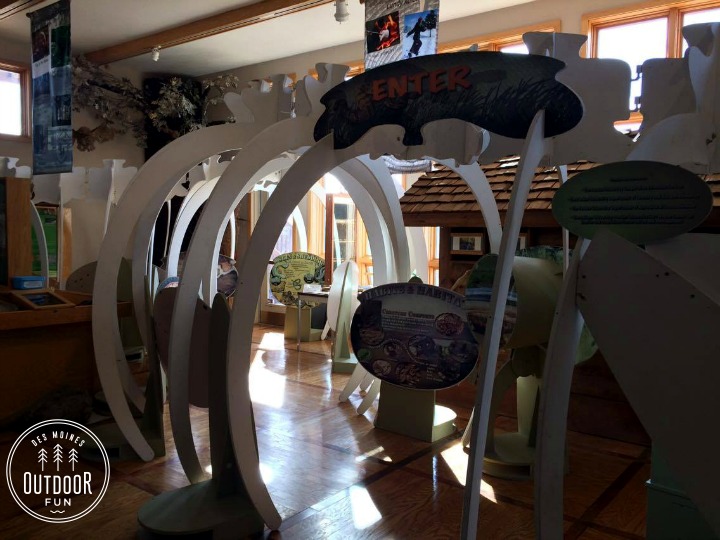
Where is `window pane`? window pane is located at coordinates (643, 37).